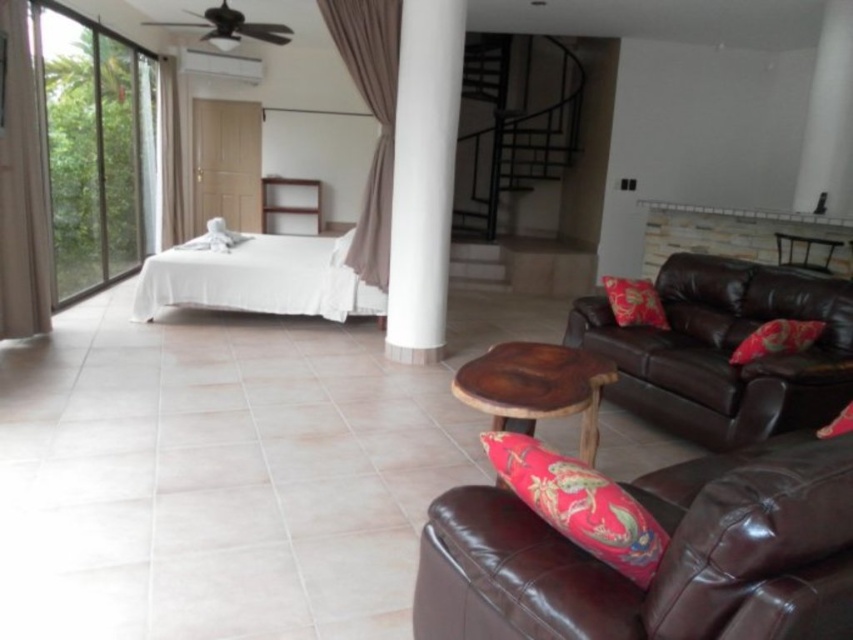
You are standing in the living area and want to move from the point closer to you to the point further away. Which path would you take between the two points, point (375, 88) and point (180, 188)?

You should move towards point (180, 188) because it is further away from you compared to point (375, 88), which is closer.